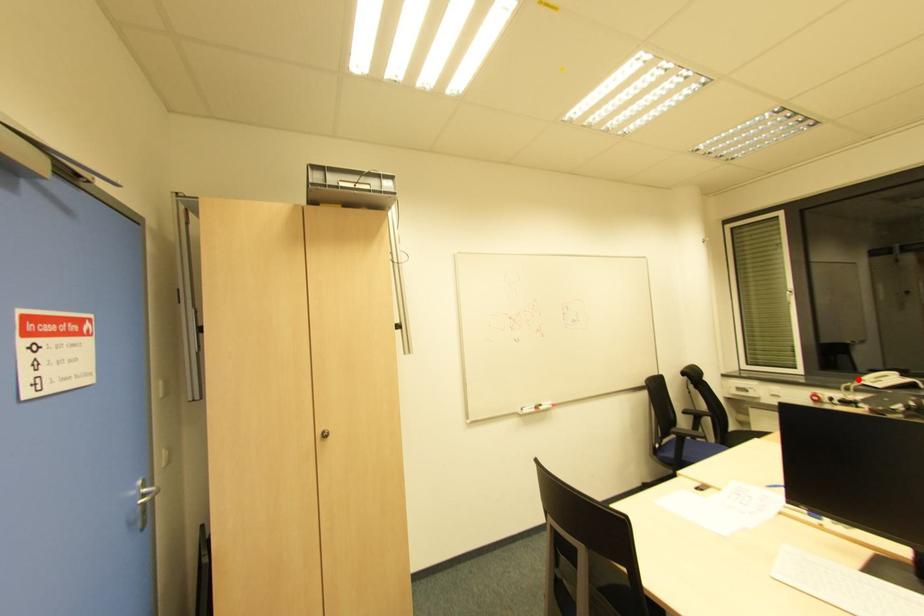
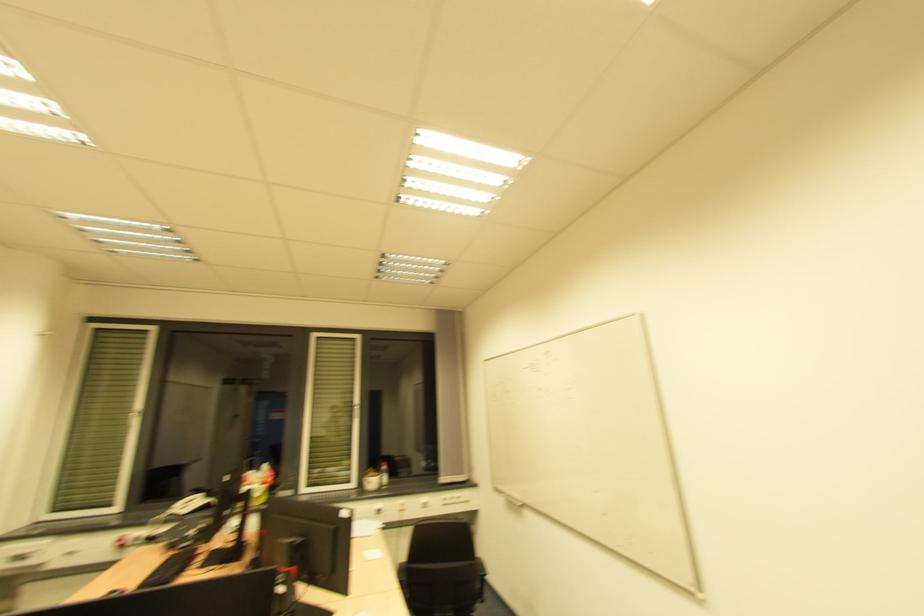
Question: I am providing you with two images of the same scene from different viewpoints. Given a red point in image1, look at the same physical point in image2. Is it:

Choices:
 (A) Closer to the viewpoint
 (B) Farther from the viewpoint

Answer: (A)